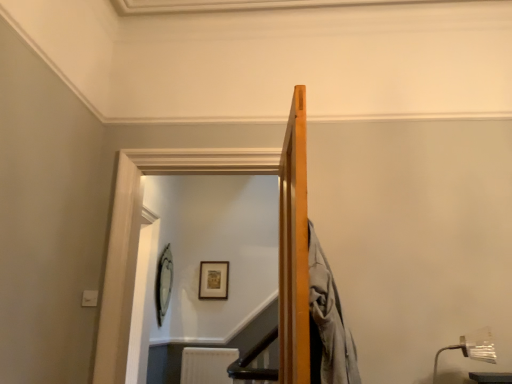
Question: From the image's perspective, is wooden picture frame at upper center, which is counted as the 1th picture frame, starting from the right, over clear glass door at upper center?

Choices:
 (A) yes
 (B) no

Answer: (B)

Question: Is wooden picture frame at upper center, which is counted as the 1th picture frame, starting from the right, not close to clear glass door at upper center?

Choices:
 (A) yes
 (B) no

Answer: (B)

Question: Is wooden picture frame at upper center, which is counted as the 1th picture frame, starting from the right, aimed at clear glass door at upper center?

Choices:
 (A) yes
 (B) no

Answer: (A)

Question: Considering the relative sizes of wooden picture frame at upper center, which is counted as the 1th picture frame, starting from the right, and clear glass door at upper center in the image provided, is wooden picture frame at upper center, which is counted as the 1th picture frame, starting from the right, smaller than clear glass door at upper center?

Choices:
 (A) no
 (B) yes

Answer: (B)

Question: Is wooden picture frame at upper center, which ranks as the 2th picture frame in left-to-right order, located outside clear glass door at upper center?

Choices:
 (A) no
 (B) yes

Answer: (B)

Question: Is wooden picture frame at upper center, which is counted as the 1th picture frame, starting from the right, oriented away from clear glass door at upper center?

Choices:
 (A) no
 (B) yes

Answer: (A)

Question: Is metallic silver lamp at lower right positioned beyond the bounds of wooden picture frame at upper center, which ranks as the 2th picture frame in left-to-right order?

Choices:
 (A) yes
 (B) no

Answer: (A)

Question: Is metallic silver lamp at lower right far away from wooden picture frame at upper center, which is counted as the 1th picture frame, starting from the right?

Choices:
 (A) yes
 (B) no

Answer: (A)

Question: Is metallic silver lamp at lower right at the left side of wooden picture frame at upper center, which is counted as the 1th picture frame, starting from the right?

Choices:
 (A) no
 (B) yes

Answer: (A)

Question: Is the position of metallic silver lamp at lower right less distant than that of wooden picture frame at upper center, which ranks as the 2th picture frame in left-to-right order?

Choices:
 (A) no
 (B) yes

Answer: (B)

Question: Does metallic silver lamp at lower right have a lesser height compared to wooden picture frame at upper center, which ranks as the 2th picture frame in left-to-right order?

Choices:
 (A) no
 (B) yes

Answer: (B)

Question: Is metallic silver lamp at lower right to the right of wooden picture frame at upper center, which is counted as the 1th picture frame, starting from the right, from the viewer's perspective?

Choices:
 (A) yes
 (B) no

Answer: (A)

Question: Is clear glass door at upper center oriented away from wooden picture frame at upper center, which is counted as the 1th picture frame, starting from the right?

Choices:
 (A) no
 (B) yes

Answer: (B)